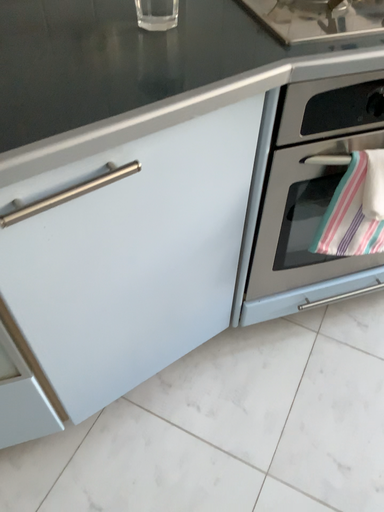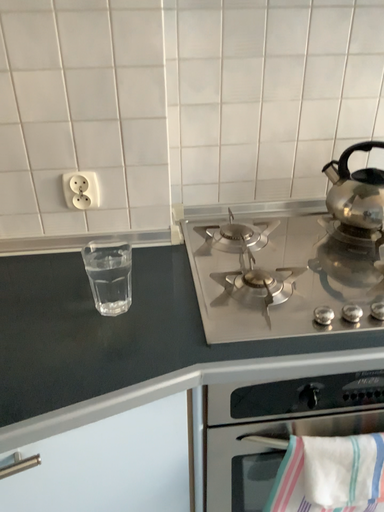
Question: How did the camera likely rotate when shooting the video?

Choices:
 (A) rotated downward
 (B) rotated upward

Answer: (B)